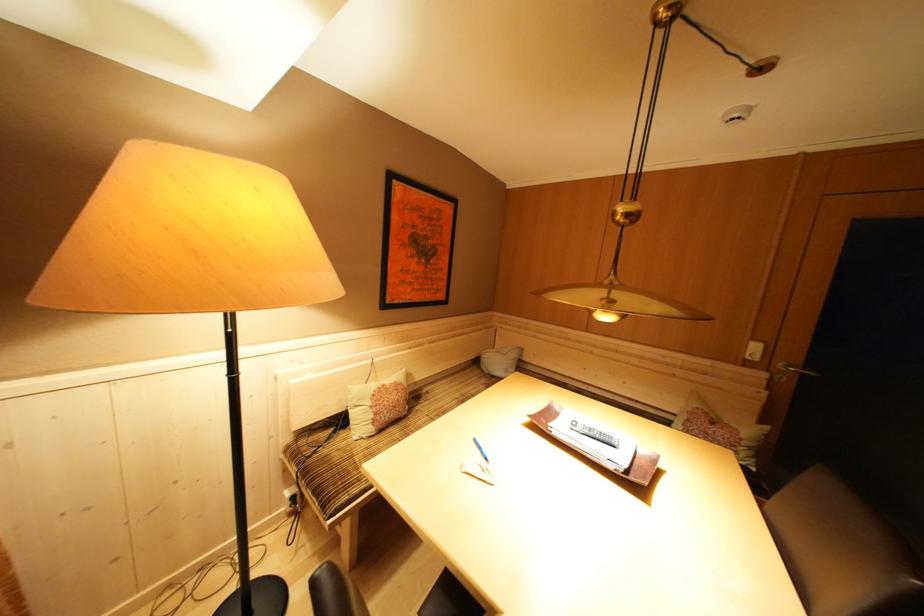
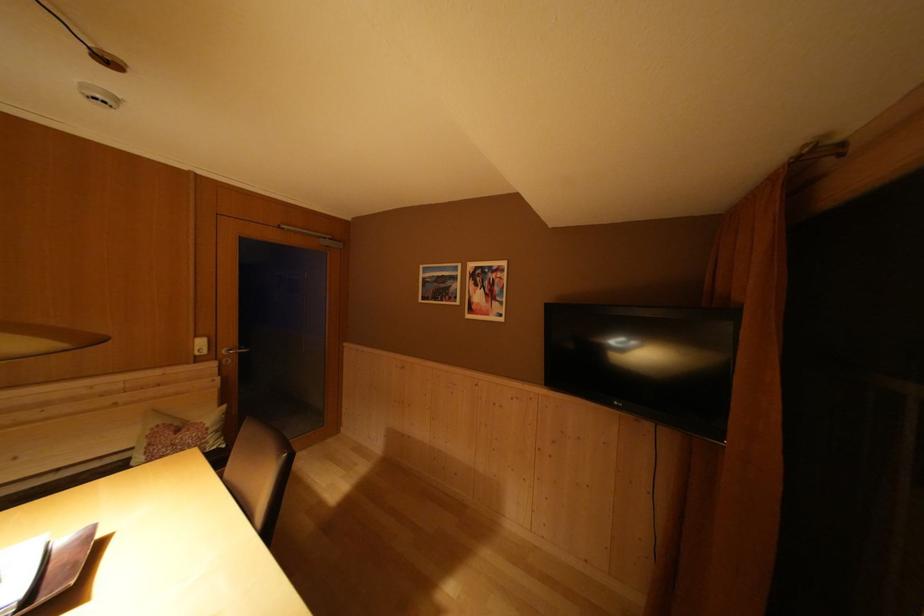
Find the pixel in the second image that matches point 760,474 in the first image.

(231, 451)